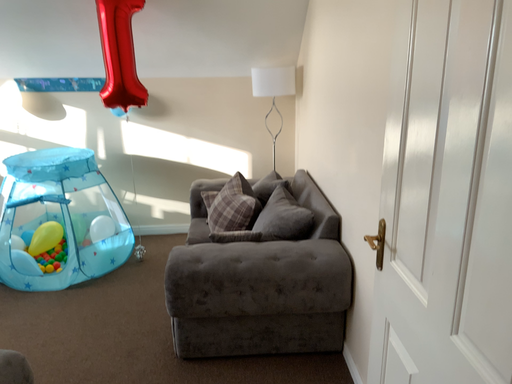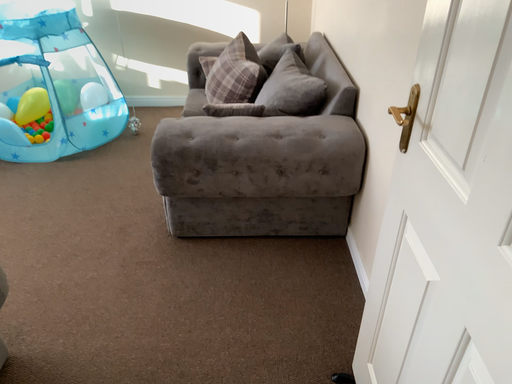
Question: How did the camera likely rotate when shooting the video?

Choices:
 (A) rotated upward
 (B) rotated downward

Answer: (B)